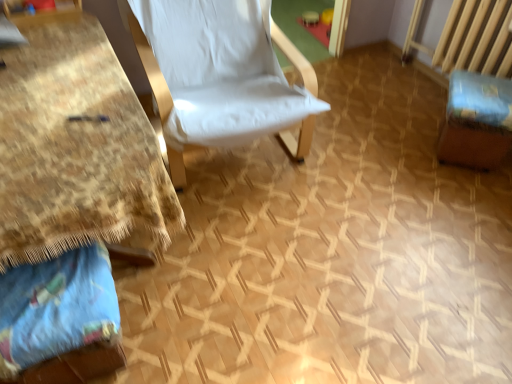
At what (x,y) coordinates should I click in order to perform the action: click on free point above blue cotton pillow at lower left (from a real-world perspective). Please return your answer as a coordinate pair (x, y). Looking at the image, I should click on tap(50, 294).